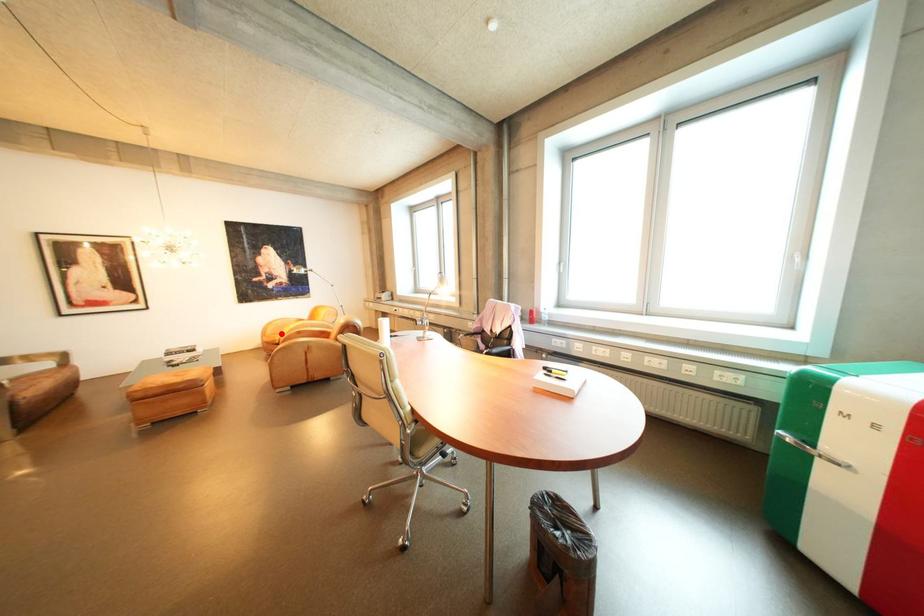
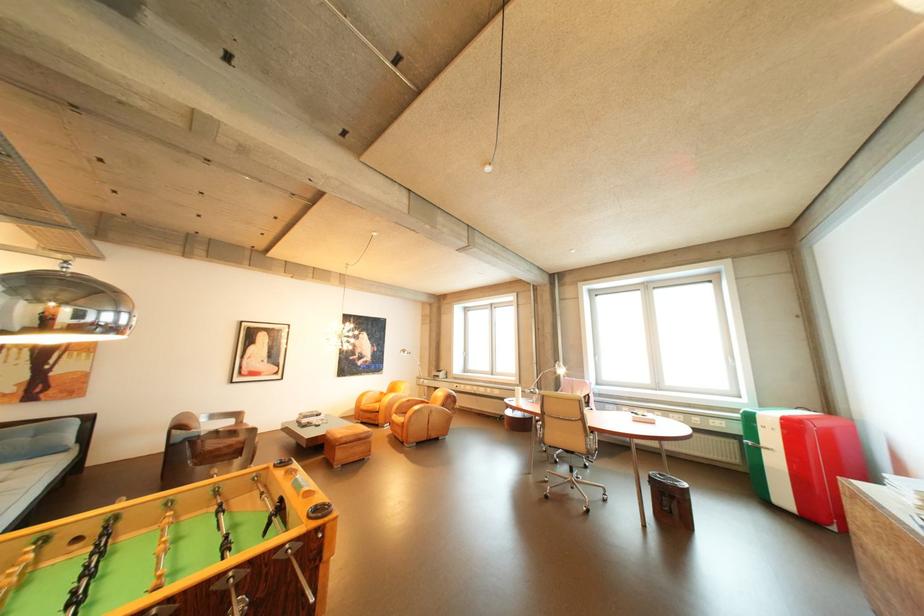
Locate, in the second image, the point that corresponds to the highlighted location in the first image.

(377, 403)